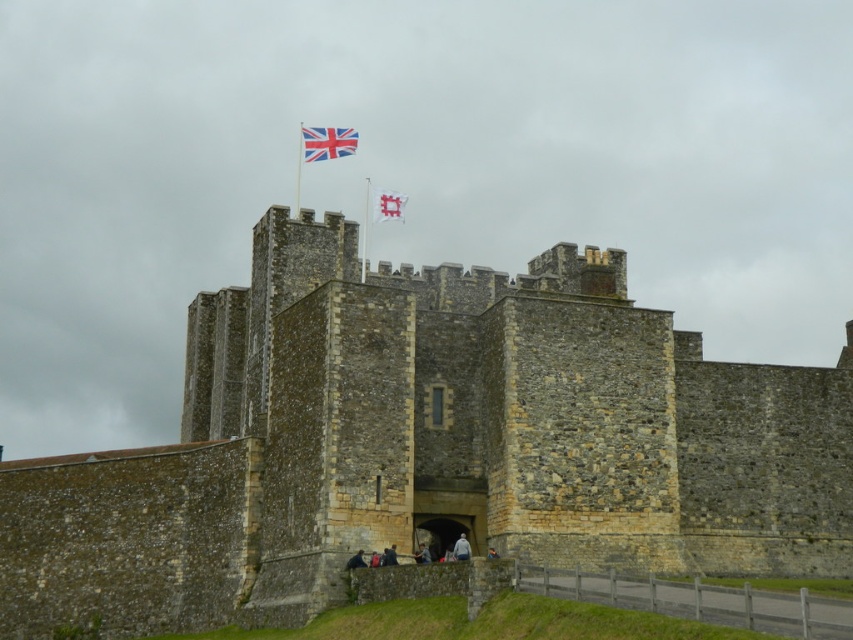
Where is `stone wall at center`? This screenshot has height=640, width=853. stone wall at center is located at coordinates (427, 444).

Is british flag at top center to the right of white fabric flag at upper center from the viewer's perspective?

No, british flag at top center is not to the right of white fabric flag at upper center.

Is point (322, 154) in front of point (381, 200)?

Yes, it is.

Identify the location of british flag at top center. Image resolution: width=853 pixels, height=640 pixels. (328, 141).

Is stone wall at center positioned before white fabric flag at upper center?

Yes.

The width and height of the screenshot is (853, 640). Describe the element at coordinates (427, 444) in the screenshot. I see `stone wall at center` at that location.

I want to click on stone wall at center, so click(x=427, y=444).